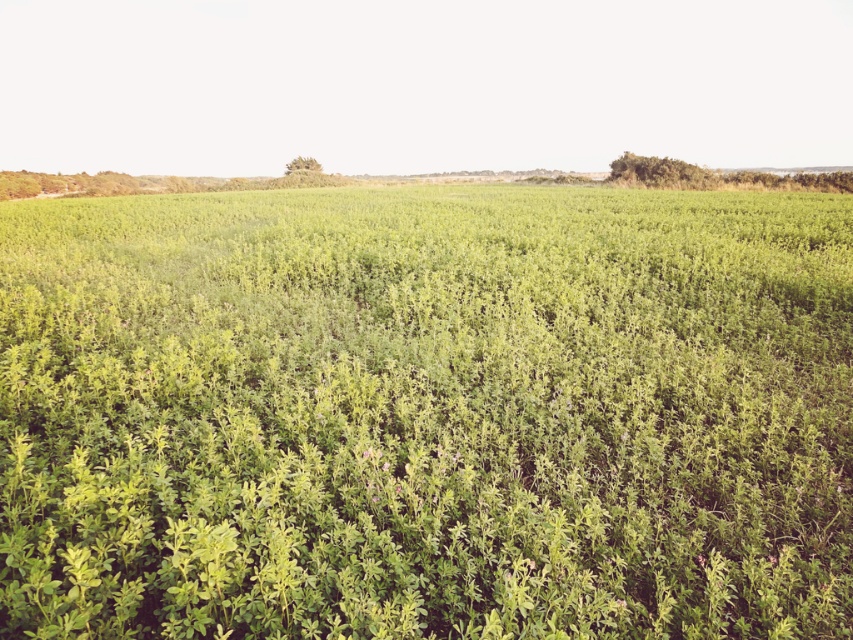
Question: Which object is positioned farthest from the green leafy bush at upper center?

Choices:
 (A) green leafy bush at upper right
 (B) green leafy grass at center

Answer: (B)

Question: Among these points, which one is nearest to the camera?

Choices:
 (A) (511, 390)
 (B) (289, 163)
 (C) (637, 161)

Answer: (A)

Question: Is green leafy bush at upper right in front of green leafy bush at upper center?

Choices:
 (A) yes
 (B) no

Answer: (A)

Question: Which point appears farthest from the camera in this image?

Choices:
 (A) (297, 168)
 (B) (590, 240)
 (C) (701, 177)

Answer: (A)

Question: Can you confirm if green leafy grass at center is positioned below green leafy bush at upper center?

Choices:
 (A) yes
 (B) no

Answer: (A)

Question: In this image, where is green leafy grass at center located relative to green leafy bush at upper center?

Choices:
 (A) right
 (B) left

Answer: (A)